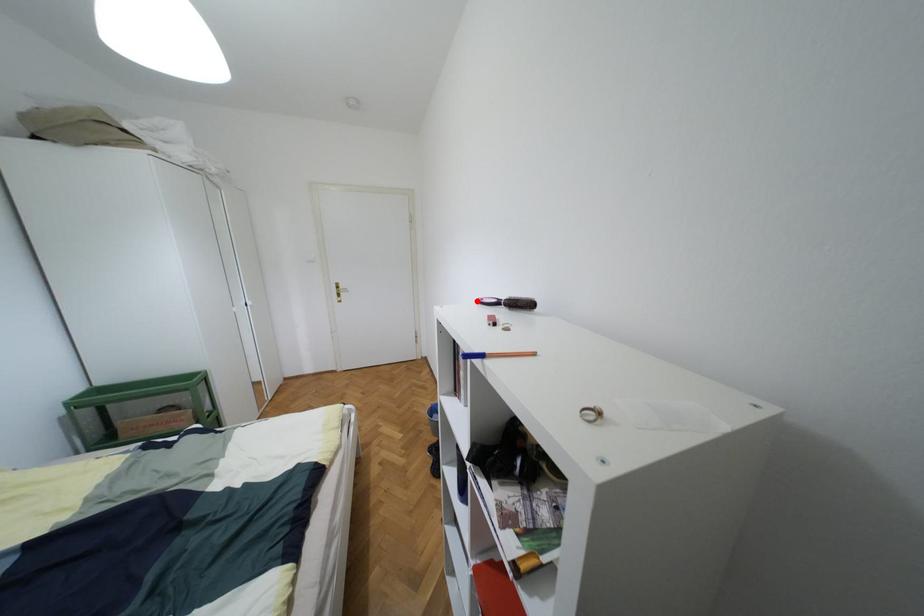
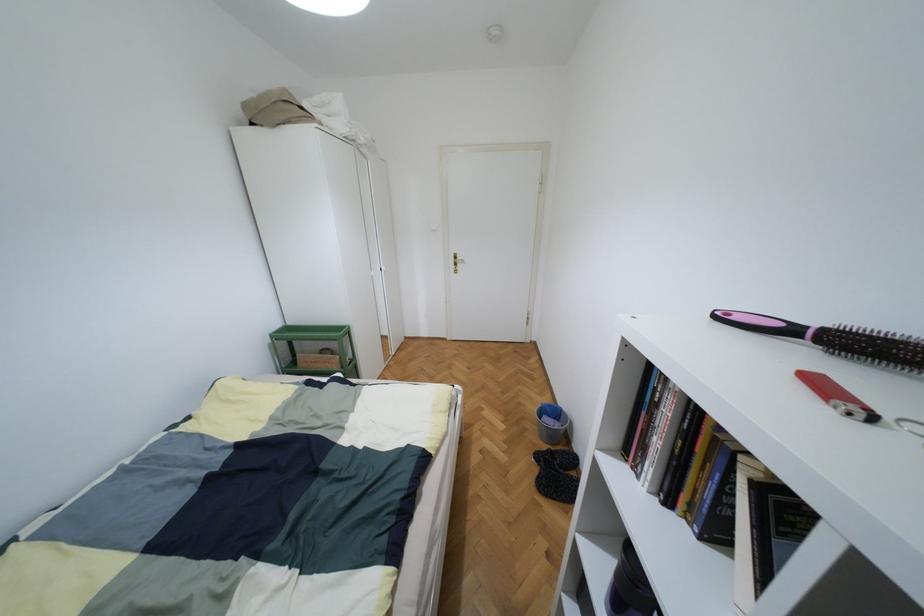
In the second image, find the point that corresponds to the highlighted location in the first image.

(713, 315)